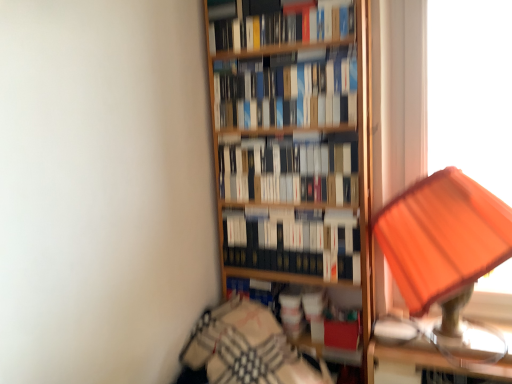
The height and width of the screenshot is (384, 512). In order to click on hardcover books at center, which is the second book in top-to-bottom order in this screenshot , I will do `click(288, 93)`.

Describe the element at coordinates (282, 28) in the screenshot. I see `hardcover books at upper center, the fourth book in the bottom-to-top sequence` at that location.

What do you see at coordinates (245, 349) in the screenshot?
I see `patterned fabric at lower left` at bounding box center [245, 349].

What do you see at coordinates (289, 173) in the screenshot? The width and height of the screenshot is (512, 384). I see `hardcover books at center, acting as the 3th book starting from the top` at bounding box center [289, 173].

In order to face metallic gold table at right, should I rotate leftwards or rightwards?

It's best to rotate right around 23.718 degrees.

At what (x,y) coordinates should I click in order to perform the action: click on metallic gold table at right. Please return your answer as a coordinate pair (x, y). This screenshot has width=512, height=384. Looking at the image, I should click on (440, 348).

This screenshot has width=512, height=384. Describe the element at coordinates (294, 244) in the screenshot. I see `hardcover books at center, marked as the fourth book in a top-to-bottom arrangement` at that location.

Locate an element on the screen. hardcover books at center, marked as the fourth book in a top-to-bottom arrangement is located at coordinates (294, 244).

Where is `orange fabric lampshade at right`? The width and height of the screenshot is (512, 384). orange fabric lampshade at right is located at coordinates (442, 236).

Is hardcover books at center, which ranks as the first book in bottom-to-top order, at the back of orange fabric lampshade at right?

No, hardcover books at center, which ranks as the first book in bottom-to-top order, is not at the back of orange fabric lampshade at right.

In the image, is orange fabric lampshade at right positioned in front of or behind hardcover books at center, marked as the fourth book in a top-to-bottom arrangement?

orange fabric lampshade at right is positioned closer to the viewer than hardcover books at center, marked as the fourth book in a top-to-bottom arrangement.

In order to click on table lamp below the hardcover books at center, which ranks as the first book in bottom-to-top order (from the image's perspective) in this screenshot , I will do `click(442, 236)`.

The width and height of the screenshot is (512, 384). Find the location of `the 3rd book located beneath the hardcover books at upper center, which is the 1th book from top to bottom (from a real-world perspective)`. the 3rd book located beneath the hardcover books at upper center, which is the 1th book from top to bottom (from a real-world perspective) is located at coordinates (294, 244).

Is hardcover books at upper center, which is the 1th book from top to bottom, facing towards hardcover books at center, which ranks as the first book in bottom-to-top order?

No, hardcover books at upper center, which is the 1th book from top to bottom, is not turned towards hardcover books at center, which ranks as the first book in bottom-to-top order.

Considering the sizes of hardcover books at upper center, which is the 1th book from top to bottom, and hardcover books at center, marked as the fourth book in a top-to-bottom arrangement, in the image, is hardcover books at upper center, which is the 1th book from top to bottom, taller or shorter than hardcover books at center, marked as the fourth book in a top-to-bottom arrangement,?

Considering their sizes, hardcover books at upper center, which is the 1th book from top to bottom, has less height than hardcover books at center, marked as the fourth book in a top-to-bottom arrangement.

Is the surface of hardcover books at upper center, the fourth book in the bottom-to-top sequence, in direct contact with hardcover books at center, which ranks as the first book in bottom-to-top order?

They are not placed beside each other.

How different are the orientations of metallic gold table at right and hardcover books at center, marked as the fourth book in a top-to-bottom arrangement, in degrees?

They differ by 0.119 degrees in their facing directions.

Which of these two, metallic gold table at right or hardcover books at center, which ranks as the first book in bottom-to-top order, stands shorter?

Standing shorter between the two is metallic gold table at right.

From the image's perspective, starting from the metallic gold table at right, which book is the 1st one above? Please provide its 2D coordinates.

[(294, 244)]

Could you measure the distance between metallic gold table at right and hardcover books at center, which ranks as the first book in bottom-to-top order?

A distance of 16.44 inches exists between metallic gold table at right and hardcover books at center, which ranks as the first book in bottom-to-top order.

Is patterned fabric at lower left aimed at hardcover books at center, which is the second book in top-to-bottom order?

No, patterned fabric at lower left is not facing towards hardcover books at center, which is the second book in top-to-bottom order.

Between patterned fabric at lower left and hardcover books at center, which is counted as the 3th book, starting from the bottom, which one appears on the left side from the viewer's perspective?

From the viewer's perspective, patterned fabric at lower left appears more on the left side.

Considering the relative sizes of patterned fabric at lower left and hardcover books at center, which is counted as the 3th book, starting from the bottom, in the image provided, is patterned fabric at lower left bigger than hardcover books at center, which is counted as the 3th book, starting from the bottom,?

Yes.

Could you tell me if metallic gold table at right is facing hardcover books at center, acting as the 3th book starting from the top?

No, metallic gold table at right is not aimed at hardcover books at center, acting as the 3th book starting from the top.

From a real-world perspective, which book is the 2nd one above the metallic gold table at right? Please provide its 2D coordinates.

[(289, 173)]

Based on the photo, from a real-world perspective, is metallic gold table at right physically below hardcover books at center, acting as the 3th book starting from the top?

Yes, from a real-world perspective, metallic gold table at right is beneath hardcover books at center, acting as the 3th book starting from the top.

Which is further, (246,78) or (254,238)?

The point (254,238) is farther from the camera.

Is hardcover books at center, which is counted as the 3th book, starting from the bottom, placed right next to hardcover books at center, marked as the fourth book in a top-to-bottom arrangement?

No.

Is hardcover books at center, which is counted as the 3th book, starting from the bottom, facing towards hardcover books at center, marked as the fourth book in a top-to-bottom arrangement?

No, hardcover books at center, which is counted as the 3th book, starting from the bottom, is not oriented towards hardcover books at center, marked as the fourth book in a top-to-bottom arrangement.

Can we say hardcover books at center, which is counted as the 3th book, starting from the bottom, lies outside hardcover books at center, which ranks as the first book in bottom-to-top order?

hardcover books at center, which is counted as the 3th book, starting from the bottom, is positioned outside hardcover books at center, which ranks as the first book in bottom-to-top order.

Could you tell me if hardcover books at center, which is counted as the 3th book, starting from the bottom, is turned towards hardcover books at center, which appears as the 2th book when ordered from the bottom?

No.

Considering the relative sizes of hardcover books at center, which is counted as the 3th book, starting from the bottom, and hardcover books at center, acting as the 3th book starting from the top, in the image provided, is hardcover books at center, which is counted as the 3th book, starting from the bottom, thinner than hardcover books at center, acting as the 3th book starting from the top,?

No, hardcover books at center, which is counted as the 3th book, starting from the bottom, is not thinner than hardcover books at center, acting as the 3th book starting from the top.

In the scene shown: Looking at the image, does hardcover books at center, which is the second book in top-to-bottom order, seem bigger or smaller compared to hardcover books at center, which appears as the 2th book when ordered from the bottom?

In the image, hardcover books at center, which is the second book in top-to-bottom order, appears to be larger than hardcover books at center, which appears as the 2th book when ordered from the bottom.

Considering the relative positions of hardcover books at center, which is the second book in top-to-bottom order, and hardcover books at center, acting as the 3th book starting from the top, in the image provided, is hardcover books at center, which is the second book in top-to-bottom order, to the left or to the right of hardcover books at center, acting as the 3th book starting from the top,?

hardcover books at center, which is the second book in top-to-bottom order, is positioned on hardcover books at center, acting as the 3th book starting from the top,'s left side.

In order to click on the 1st book to the left of the orange fabric lampshade at right, counting from the anchor's position in this screenshot , I will do `click(294, 244)`.

Locate an element on the screen. This screenshot has width=512, height=384. book that is the 3rd object to the right of the hardcover books at upper center, the fourth book in the bottom-to-top sequence, starting at the anchor is located at coordinates (294, 244).

Which object lies nearer to the anchor point hardcover books at center, which is counted as the 3th book, starting from the bottom, metallic gold table at right or hardcover books at center, which appears as the 2th book when ordered from the bottom?

Based on the image, hardcover books at center, which appears as the 2th book when ordered from the bottom, appears to be nearer to hardcover books at center, which is counted as the 3th book, starting from the bottom.

Based on their spatial positions, is patterned fabric at lower left or hardcover books at upper center, which is the 1th book from top to bottom, further from orange fabric lampshade at right?

Based on the image, patterned fabric at lower left appears to be further to orange fabric lampshade at right.

When comparing their distances from hardcover books at center, which ranks as the first book in bottom-to-top order, does patterned fabric at lower left or hardcover books at center, which appears as the 2th book when ordered from the bottom, seem closer?

hardcover books at center, which appears as the 2th book when ordered from the bottom, is positioned closer to the anchor hardcover books at center, which ranks as the first book in bottom-to-top order.

Considering their positions, is orange fabric lampshade at right positioned closer to hardcover books at center, which appears as the 2th book when ordered from the bottom, than metallic gold table at right?

Among the two, orange fabric lampshade at right is located nearer to hardcover books at center, which appears as the 2th book when ordered from the bottom.

Based on the photo, considering their positions, is hardcover books at center, which appears as the 2th book when ordered from the bottom, positioned closer to orange fabric lampshade at right than hardcover books at upper center, the fourth book in the bottom-to-top sequence?

Based on the image, hardcover books at center, which appears as the 2th book when ordered from the bottom, appears to be nearer to orange fabric lampshade at right.

Considering their positions, is hardcover books at center, marked as the fourth book in a top-to-bottom arrangement, positioned further to hardcover books at center, which is the second book in top-to-bottom order, than patterned fabric at lower left?

Among the two, patterned fabric at lower left is located further to hardcover books at center, which is the second book in top-to-bottom order.

Which object lies further to the anchor point metallic gold table at right, hardcover books at center, which ranks as the first book in bottom-to-top order, or hardcover books at center, acting as the 3th book starting from the top?

hardcover books at center, acting as the 3th book starting from the top.

Looking at the image, which one is located closer to hardcover books at center, acting as the 3th book starting from the top, orange fabric lampshade at right or hardcover books at upper center, which is the 1th book from top to bottom?

orange fabric lampshade at right is positioned closer to the anchor hardcover books at center, acting as the 3th book starting from the top.

This screenshot has width=512, height=384. Find the location of `table lamp that lies between hardcover books at center, which is the second book in top-to-bottom order, and patterned fabric at lower left from top to bottom`. table lamp that lies between hardcover books at center, which is the second book in top-to-bottom order, and patterned fabric at lower left from top to bottom is located at coordinates (442, 236).

Where is `window screen between hardcover books at upper center, the fourth book in the bottom-to-top sequence, and hardcover books at center, marked as the fourth book in a top-to-bottom arrangement, from top to bottom`? Image resolution: width=512 pixels, height=384 pixels. window screen between hardcover books at upper center, the fourth book in the bottom-to-top sequence, and hardcover books at center, marked as the fourth book in a top-to-bottom arrangement, from top to bottom is located at coordinates (471, 90).

You are a GUI agent. You are given a task and a screenshot of the screen. Output one action in this format:
    pyautogui.click(x=<x>, y=<y>)
    Task: Click on the book between hardcover books at center, acting as the 3th book starting from the top, and patterned fabric at lower left, in the vertical direction
    The height and width of the screenshot is (384, 512).
    Given the screenshot: What is the action you would take?
    pyautogui.click(x=294, y=244)

Where is `table lamp between orange fabric lampshade at right and patterned fabric at lower left vertically`? This screenshot has height=384, width=512. table lamp between orange fabric lampshade at right and patterned fabric at lower left vertically is located at coordinates (442, 236).